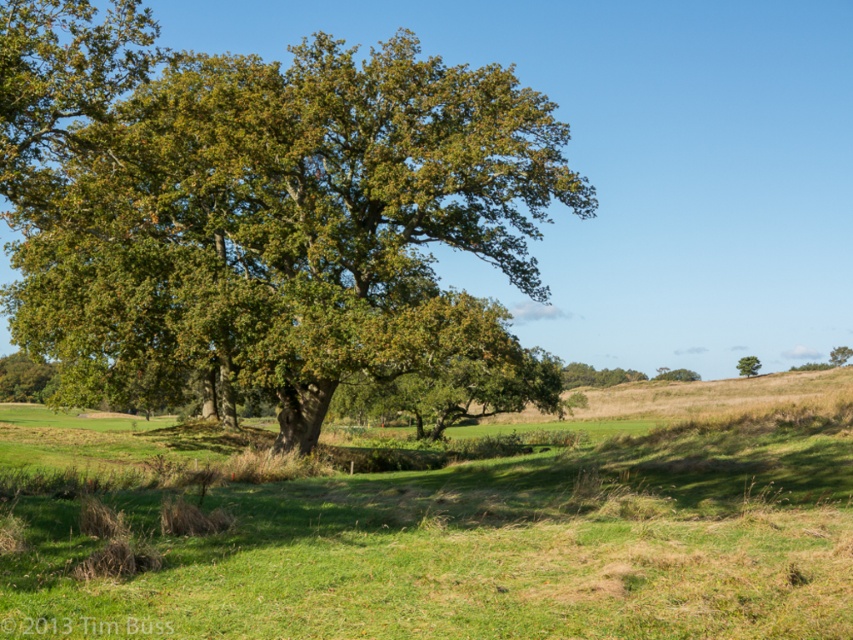
You are a gardener planning to plant a new tree in your backyard. You have two options from the image, the green matte tree at right and the green leafy tree at upper center. Based on their thickness, which tree would require less space for its trunk?

The green matte tree at right is thinner than the green leafy tree at upper center, so it would require less space for its trunk.

You are an environmental scientist assessing the biodiversity of this rural landscape. You notice the green leafy oak tree at upper left and the green leafy tree at upper center. Which tree would likely provide more shade for the surrounding area?

The green leafy oak tree at upper left is much taller than the green leafy tree at upper center, so it would likely provide more shade for the surrounding area due to its greater height.